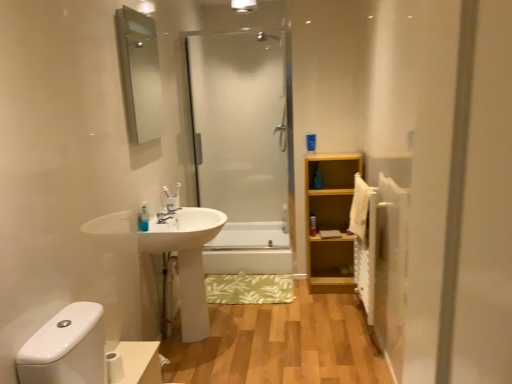
Question: In the image, is translucent plastic soap at left, placed as the first toiletry when sorted from front to back, on the left side or the right side of white glossy sink at center left?

Choices:
 (A) left
 (B) right

Answer: (A)

Question: Considering the positions of point (143, 223) and point (200, 329), is point (143, 223) closer or farther from the camera than point (200, 329)?

Choices:
 (A) closer
 (B) farther

Answer: (A)

Question: Which object is positioned closest to the white glossy toilet paper at lower left?

Choices:
 (A) white glossy light fixture at upper center
 (B) white matte toilet paper at lower left
 (C) clear glass mirror at upper left
 (D) light wood shelf at right
 (E) transparent glass shower door at center

Answer: (B)

Question: Based on their relative distances, which object is farther from the white textured radiator at right?

Choices:
 (A) white glossy light fixture at upper center
 (B) light brown wood floor at lower center
 (C) white glossy toilet paper at lower left
 (D) white glossy sink at center left
 (E) transparent glass shower door at center

Answer: (A)